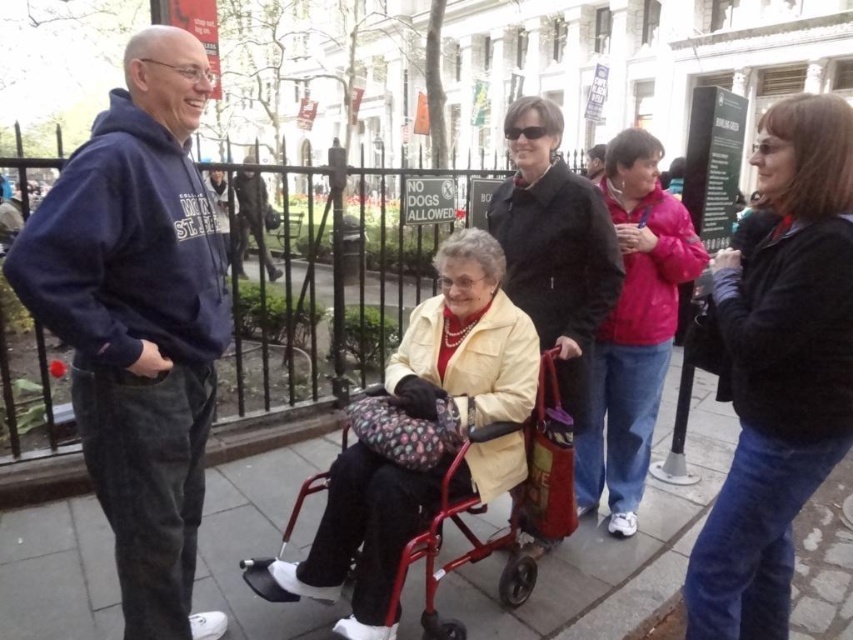
Does navy blue hoodie at left have a greater height compared to smooth concrete sidewalk at center?

Yes, navy blue hoodie at left is taller than smooth concrete sidewalk at center.

Does navy blue hoodie at left appear under smooth concrete sidewalk at center?

Incorrect, navy blue hoodie at left is not positioned below smooth concrete sidewalk at center.

What are the coordinates of `navy blue hoodie at left` in the screenshot? It's located at (138, 321).

Based on the photo, can you confirm if navy blue hoodie at left is positioned above matte pink jacket at center?

No, navy blue hoodie at left is not above matte pink jacket at center.

Which is behind, point (38, 276) or point (596, 432)?

The point (596, 432) is more distant.

Between point (163, 637) and point (653, 397), which one is positioned in front?

Point (163, 637) is more forward.

What are the coordinates of `navy blue hoodie at left` in the screenshot? It's located at (138, 321).

Between smooth concrete sidewalk at center and black leather jacket at center, which one has less height?

With less height is smooth concrete sidewalk at center.

Which is behind, point (660, 486) or point (537, 273)?

The point (660, 486) is behind.

In order to click on smooth concrete sidewalk at center in this screenshot , I will do `click(607, 554)`.